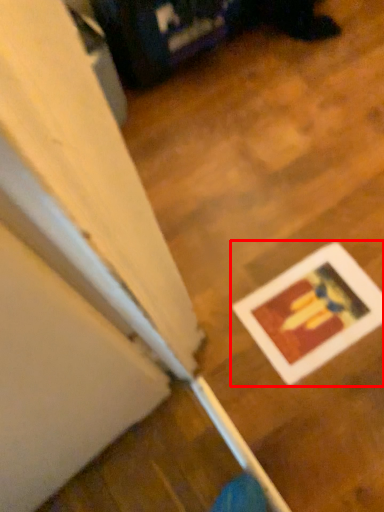
Question: Considering the relative positions of picture frame (annotated by the red box) and wood in the image provided, where is picture frame (annotated by the red box) located with respect to the staircase?

Choices:
 (A) left
 (B) right

Answer: (B)